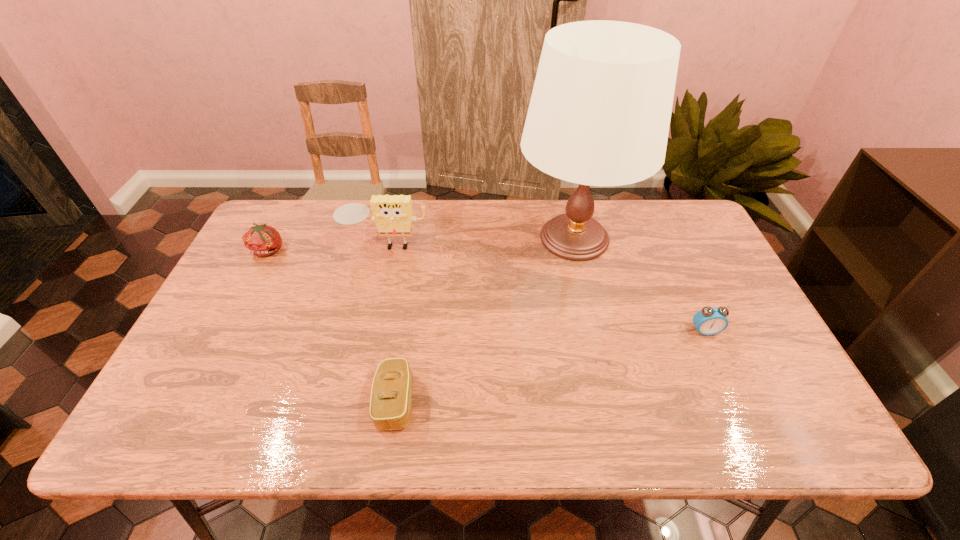
I want to click on blank space at the near edge of the desktop, so click(x=447, y=426).

Find the location of a particular element. vacant space at the left edge is located at coordinates (208, 333).

In the image, there is a desktop. Where is `vacant space at the right edge`? This screenshot has width=960, height=540. vacant space at the right edge is located at coordinates (740, 350).

I want to click on free space between the clutch bag and the sponge, so click(391, 323).

At what (x,y) coordinates should I click in order to perform the action: click on free spot between the second tallest object and the leftmost object. Please return your answer as a coordinate pair (x, y). Image resolution: width=960 pixels, height=540 pixels. Looking at the image, I should click on click(327, 247).

I want to click on unoccupied area between the sponge and the lamp, so click(x=480, y=241).

Find the location of a particular element. vacant area that lies between the fourth object from left to right and the rightmost object is located at coordinates (639, 285).

You are a GUI agent. You are given a task and a screenshot of the screen. Output one action in this format:
    pyautogui.click(x=<x>, y=<y>)
    Task: Click on the vacant area between the sponge and the rightmost object
    Image resolution: width=960 pixels, height=540 pixels.
    Given the screenshot: What is the action you would take?
    pyautogui.click(x=545, y=288)

Where is `vacant space that is in between the clutch bag and the leftmost object`? Image resolution: width=960 pixels, height=540 pixels. vacant space that is in between the clutch bag and the leftmost object is located at coordinates (332, 326).

The height and width of the screenshot is (540, 960). Find the location of `free spot between the second object from right to left and the tomato`. free spot between the second object from right to left and the tomato is located at coordinates (421, 244).